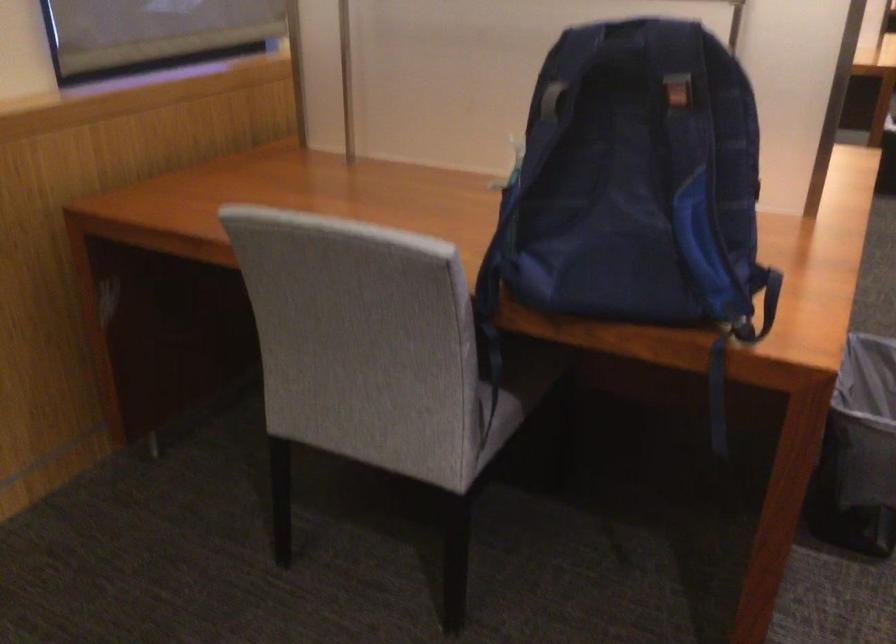
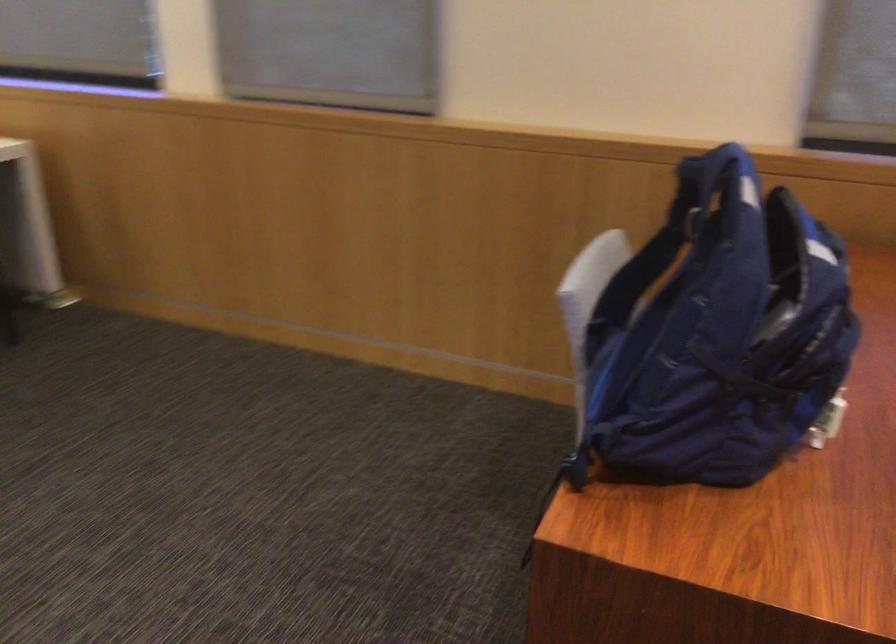
Where in the second image is the point corresponding to the point at 650,80 from the first image?

(687, 216)